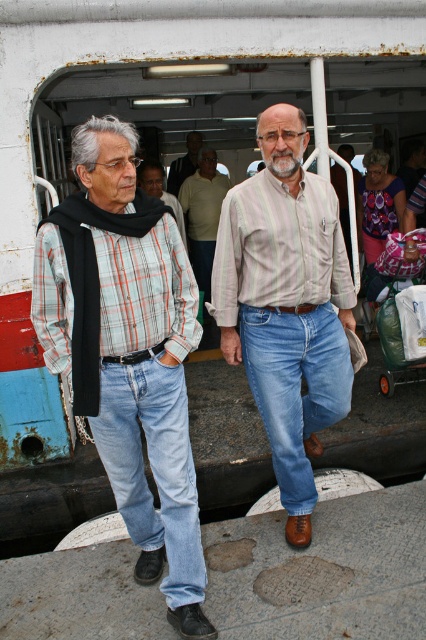
From the picture: You are a photographer trying to capture a candid shot of the two men. You notice the blue denim jeans at left and the light brown shirt at center. Which clothing item is located to the right of the other?

The blue denim jeans at left is positioned on the right side of light brown shirt at center, so the blue denim jeans at left is to the right of the light brown shirt at center.

Based on the scene description, can you determine the spatial relationship between the plaid cotton shirt at left and the blue denim jeans at left?

The plaid cotton shirt at left is above the blue denim jeans at left.

You are a photographer positioned at the front of the ferry deck. You want to take a photo that includes both the blue denim jeans at left and the light brown shirt at center. Which object should you focus on first to ensure both are in sharp focus?

You should focus on the blue denim jeans at left first since it is closer to the viewer than the light brown shirt at center, ensuring both will be in focus when using depth of field appropriately.